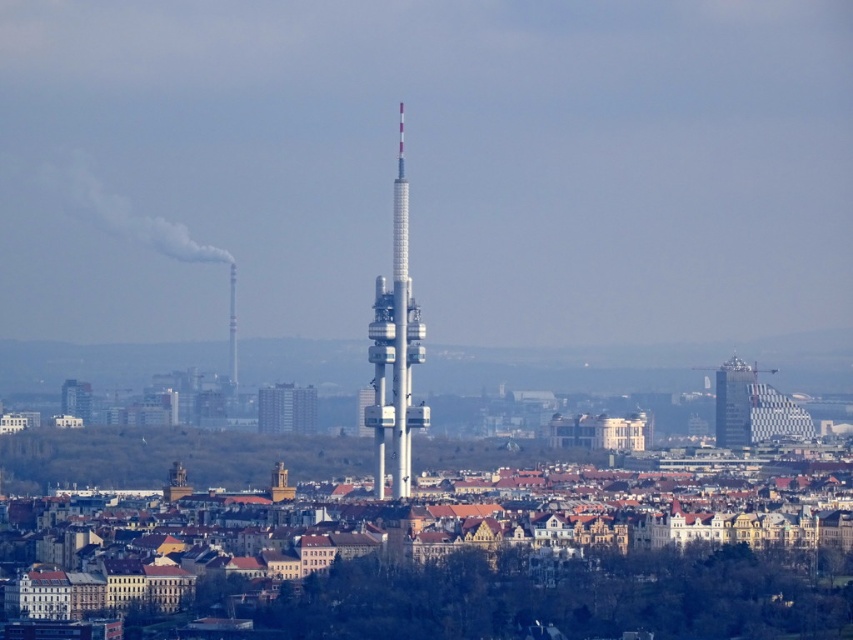
Does white metallic tower at center appear on the left side of glassy silver skyscraper at right?

Correct, you'll find white metallic tower at center to the left of glassy silver skyscraper at right.

Is point (378, 336) closer to camera compared to point (724, 432)?

Yes, it is.

Identify the location of white metallic tower at center. (395, 349).